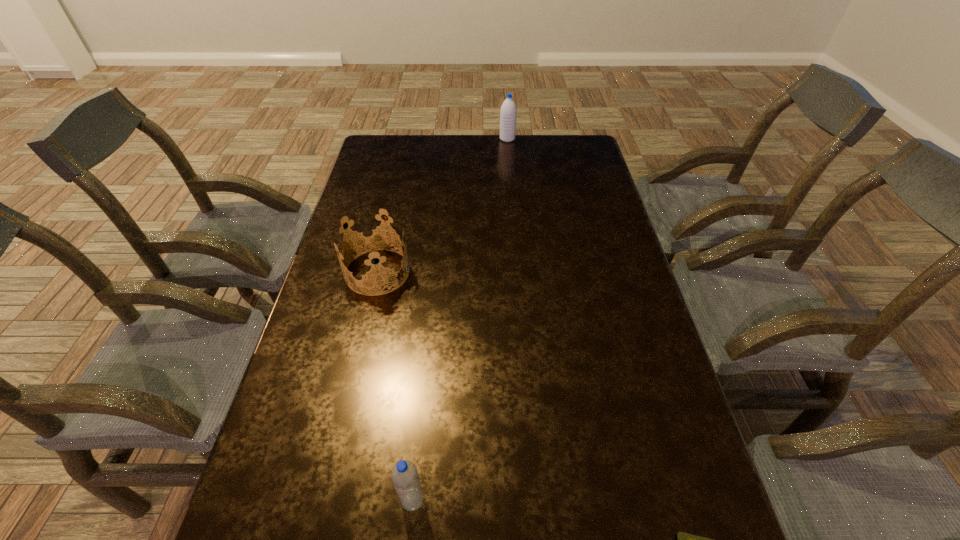
Where is `object located in the left edge section of the desktop`? This screenshot has width=960, height=540. object located in the left edge section of the desktop is located at coordinates (376, 273).

I want to click on vacant space at the far edge, so click(x=439, y=154).

The height and width of the screenshot is (540, 960). Find the location of `vacant space at the left edge of the desktop`. vacant space at the left edge of the desktop is located at coordinates 361,207.

Identify the location of vacant space at the right edge of the desktop. (610, 259).

You are a GUI agent. You are given a task and a screenshot of the screen. Output one action in this format:
    pyautogui.click(x=<x>, y=<y>)
    Task: Click on the free space at the far left corner of the desktop
    This screenshot has width=960, height=540.
    Given the screenshot: What is the action you would take?
    pyautogui.click(x=401, y=166)

Identify the location of free spot at the far right corner of the desktop. (562, 136).

Locate an element on the screen. Image resolution: width=960 pixels, height=540 pixels. vacant region between the second farthest object and the nearer water bottle is located at coordinates (395, 386).

Find the location of a particular element. The width and height of the screenshot is (960, 540). blank region between the third nearest object and the farthest object is located at coordinates (443, 205).

In order to click on vacant space in between the farther water bottle and the leftmost object in this screenshot , I will do `click(443, 205)`.

Locate an element on the screen. The image size is (960, 540). unoccupied area between the farther water bottle and the crown is located at coordinates (443, 205).